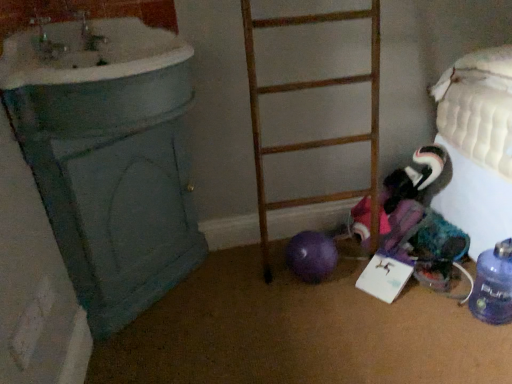
Question: Is wooden ladder at center at the right side of white glossy sink at upper left?

Choices:
 (A) no
 (B) yes

Answer: (B)

Question: Are wooden ladder at center and white glossy sink at upper left far apart?

Choices:
 (A) no
 (B) yes

Answer: (A)

Question: From a real-world perspective, is wooden ladder at center under white glossy sink at upper left?

Choices:
 (A) yes
 (B) no

Answer: (A)

Question: Considering the relative sizes of wooden ladder at center and white glossy sink at upper left in the image provided, is wooden ladder at center shorter than white glossy sink at upper left?

Choices:
 (A) no
 (B) yes

Answer: (A)

Question: Is the position of wooden ladder at center more distant than that of white glossy sink at upper left?

Choices:
 (A) no
 (B) yes

Answer: (B)

Question: Considering the positions of white glossy sink at upper left and wooden ladder at center in the image, is white glossy sink at upper left taller or shorter than wooden ladder at center?

Choices:
 (A) tall
 (B) short

Answer: (B)

Question: From the image's perspective, is white glossy sink at upper left above or below wooden ladder at center?

Choices:
 (A) above
 (B) below

Answer: (A)

Question: Based on their positions, is white glossy sink at upper left located to the left or right of wooden ladder at center?

Choices:
 (A) right
 (B) left

Answer: (B)

Question: Is white glossy sink at upper left in front of or behind wooden ladder at center in the image?

Choices:
 (A) behind
 (B) front

Answer: (B)

Question: Is blue translucent bottle at lower right taller or shorter than wooden ladder at center?

Choices:
 (A) short
 (B) tall

Answer: (A)

Question: In the image, is blue translucent bottle at lower right positioned in front of or behind wooden ladder at center?

Choices:
 (A) behind
 (B) front

Answer: (A)

Question: From the image's perspective, is blue translucent bottle at lower right above or below wooden ladder at center?

Choices:
 (A) above
 (B) below

Answer: (B)

Question: Do you think blue translucent bottle at lower right is within wooden ladder at center, or outside of it?

Choices:
 (A) inside
 (B) outside

Answer: (B)

Question: Looking at the image, does wooden ladder at center seem bigger or smaller compared to blue translucent bottle at lower right?

Choices:
 (A) small
 (B) big

Answer: (B)

Question: From a real-world perspective, is wooden ladder at center physically located above or below blue translucent bottle at lower right?

Choices:
 (A) below
 (B) above

Answer: (B)